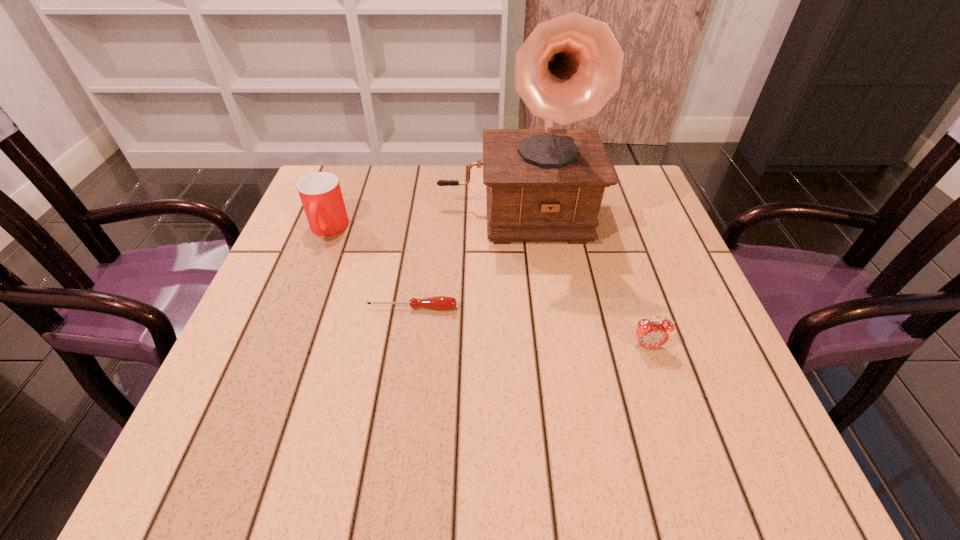
In order to click on free point between the third farthest object and the second tallest object in this screenshot , I will do `click(370, 268)`.

The image size is (960, 540). I want to click on free space between the tallest object and the cup, so click(420, 219).

Find the location of a particular element. The height and width of the screenshot is (540, 960). vacant point located between the second shortest object and the tallest object is located at coordinates (581, 278).

Locate an element on the screen. object that stands as the closest to the alarm clock is located at coordinates coord(543,185).

Select which object is the third closest to the second shortest object. Please provide its 2D coordinates. Your answer should be formatted as a tuple, i.e. [(x, y)], where the tuple contains the x and y coordinates of a point satisfying the conditions above.

[(320, 193)]

The height and width of the screenshot is (540, 960). In order to click on vacant area that satisfies the following two spatial constraints: 1. on the side of the second nearest object with the handle; 2. on the left side of the third shortest object in this screenshot , I will do `click(298, 308)`.

Where is `free space that satisfies the following two spatial constraints: 1. on the side of the screwdriver with the handle; 2. on the right side of the cup`? Image resolution: width=960 pixels, height=540 pixels. free space that satisfies the following two spatial constraints: 1. on the side of the screwdriver with the handle; 2. on the right side of the cup is located at coordinates (298, 308).

Locate an element on the screen. The width and height of the screenshot is (960, 540). free point that satisfies the following two spatial constraints: 1. on the side of the leftmost object with the handle; 2. on the left side of the shortest object is located at coordinates (298, 308).